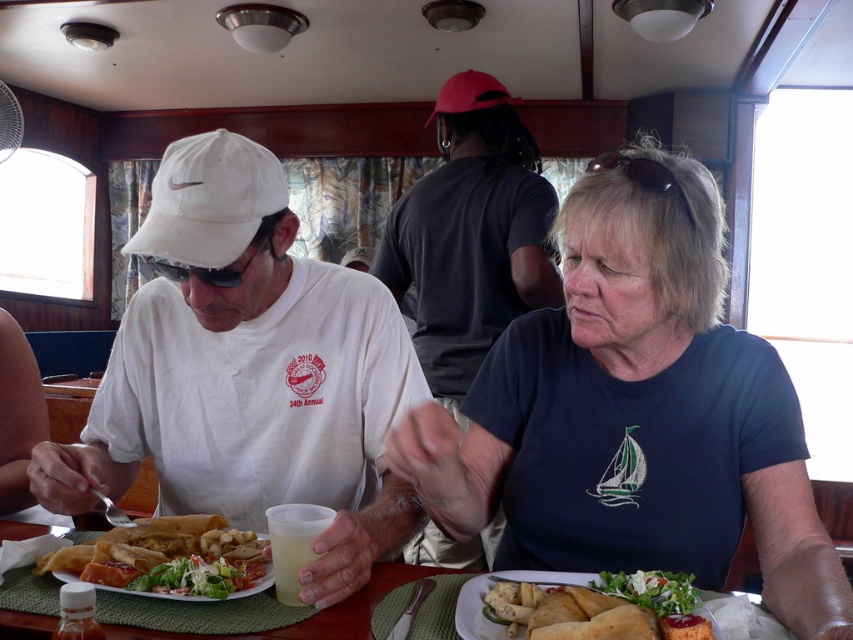
You are a photographer trying to capture a candid shot of the two people at the table. Since the white matte baseball cap at upper left and the blue cotton shirt at center are in your viewfinder, which one might block your view of the other if you adjust your angle slightly?

The white matte baseball cap at upper left is not as tall as the blue cotton shirt at center, so the blue cotton shirt at center is taller and could potentially block the view of the white matte baseball cap at upper left when adjusting the angle.

You are standing at the back of the dining area and want to take a photo of the white matte baseball cap at upper left. The camera you are using has a maximum focus range of 30 inches. Will you be able to capture the cap clearly in your photo?

The white matte baseball cap at upper left is 32.84 inches away from the camera. Since the camera can only focus up to 30 inches, you won t be able to capture the cap clearly. Move closer or use a different camera with a longer focus range.